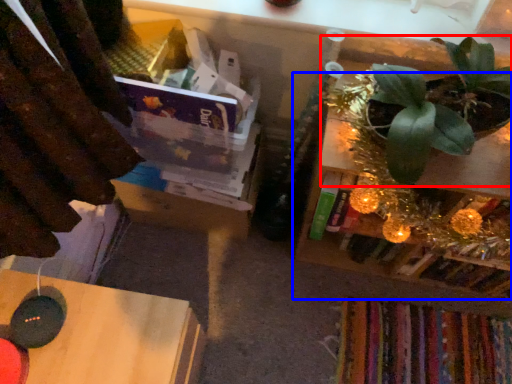
Question: Which object is closer to the camera taking this photo, houseplant (highlighted by a red box) or shelf (highlighted by a blue box)?

Choices:
 (A) houseplant
 (B) shelf

Answer: (A)